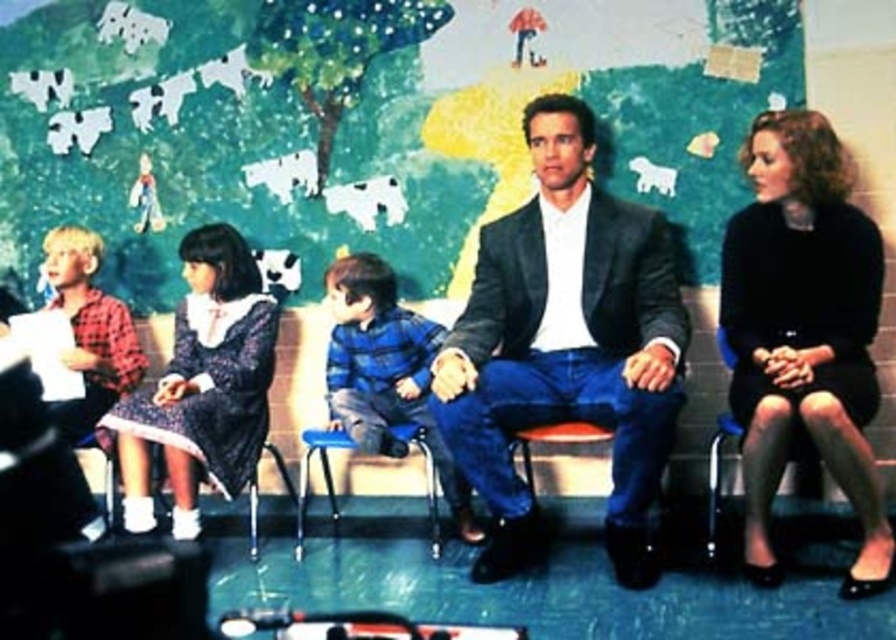
Question: Which object appears farthest from the camera in this image?

Choices:
 (A) black matte dress at right
 (B) patterned fabric dress at left
 (C) blue plaid shirt at center
 (D) black plastic chair at right

Answer: (B)

Question: Considering the real-world distances, which object is closest to the patterned fabric dress at left?

Choices:
 (A) black matte dress at right
 (B) matte black suit at center
 (C) black plastic chair at right

Answer: (B)

Question: Does black matte dress at right have a larger size compared to black plastic chair at right?

Choices:
 (A) no
 (B) yes

Answer: (B)

Question: Is matte black suit at center positioned behind black matte dress at right?

Choices:
 (A) no
 (B) yes

Answer: (B)

Question: Which of the following is the farthest from the observer?

Choices:
 (A) patterned fabric dress at left
 (B) black matte dress at right
 (C) blue plaid shirt at center
 (D) matte black suit at center

Answer: (A)

Question: In this image, where is matte black suit at center located relative to black matte dress at right?

Choices:
 (A) below
 (B) above

Answer: (B)